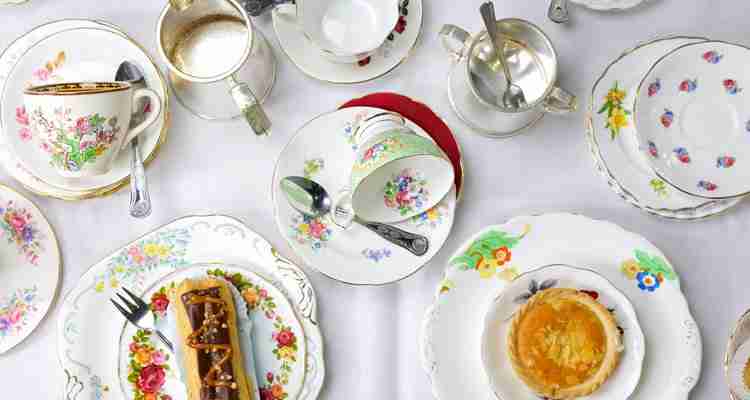
Locate an element on the screen. This screenshot has width=750, height=400. utensils is located at coordinates (136, 164), (136, 294), (310, 199), (495, 36), (559, 8).